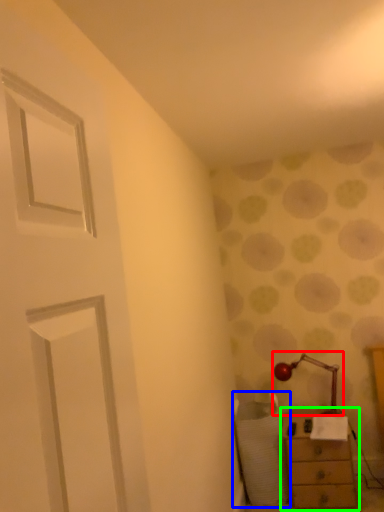
Question: Which is nearer to the table lamp (highlighted by a red box)? swivel chair (highlighted by a blue box) or chest of drawers (highlighted by a green box).

Choices:
 (A) swivel chair
 (B) chest of drawers

Answer: (B)